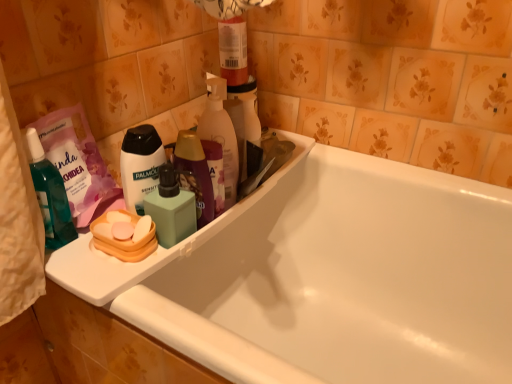
Question: Can you confirm if white glossy bathtub at center is smaller than white plastic tray at upper left?

Choices:
 (A) yes
 (B) no

Answer: (B)

Question: Does white glossy bathtub at center turn towards white plastic tray at upper left?

Choices:
 (A) yes
 (B) no

Answer: (B)

Question: Is white glossy bathtub at center at the left side of white plastic tray at upper left?

Choices:
 (A) yes
 (B) no

Answer: (B)

Question: Does white glossy bathtub at center have a lesser height compared to white plastic tray at upper left?

Choices:
 (A) yes
 (B) no

Answer: (B)

Question: Is white glossy bathtub at center next to white plastic tray at upper left and touching it?

Choices:
 (A) no
 (B) yes

Answer: (A)

Question: From the image's perspective, is white glossy bathtub at center located above white plastic tray at upper left?

Choices:
 (A) no
 (B) yes

Answer: (A)

Question: Considering the relative sizes of translucent teal bottle at left, the second toiletry from the right, and orange plastic soap at left, the first personal care in the bottom-to-top sequence, in the image provided, is translucent teal bottle at left, the second toiletry from the right, thinner than orange plastic soap at left, the first personal care in the bottom-to-top sequence,?

Choices:
 (A) no
 (B) yes

Answer: (B)

Question: From a real-world perspective, is translucent teal bottle at left, the first toiletry viewed from the left, under orange plastic soap at left, the first personal care in the bottom-to-top sequence?

Choices:
 (A) yes
 (B) no

Answer: (B)

Question: Does translucent teal bottle at left, the second toiletry from the right, have a larger size compared to orange plastic soap at left, positioned as the 2th personal care in top-to-bottom order?

Choices:
 (A) no
 (B) yes

Answer: (B)

Question: Is translucent teal bottle at left, the second toiletry from the right, taller than orange plastic soap at left, the first personal care in the bottom-to-top sequence?

Choices:
 (A) no
 (B) yes

Answer: (B)

Question: Considering the relative positions of translucent teal bottle at left, the first toiletry viewed from the left, and orange plastic soap at left, positioned as the 2th personal care in top-to-bottom order, in the image provided, is translucent teal bottle at left, the first toiletry viewed from the left, to the right of orange plastic soap at left, positioned as the 2th personal care in top-to-bottom order, from the viewer's perspective?

Choices:
 (A) yes
 (B) no

Answer: (B)

Question: From the image's perspective, is translucent teal bottle at left, the first toiletry viewed from the left, on orange plastic soap at left, positioned as the 2th personal care in top-to-bottom order?

Choices:
 (A) no
 (B) yes

Answer: (B)

Question: Can you confirm if orange plastic soap at left, the first personal care in the bottom-to-top sequence, is shorter than white glossy bathtub at center?

Choices:
 (A) no
 (B) yes

Answer: (B)